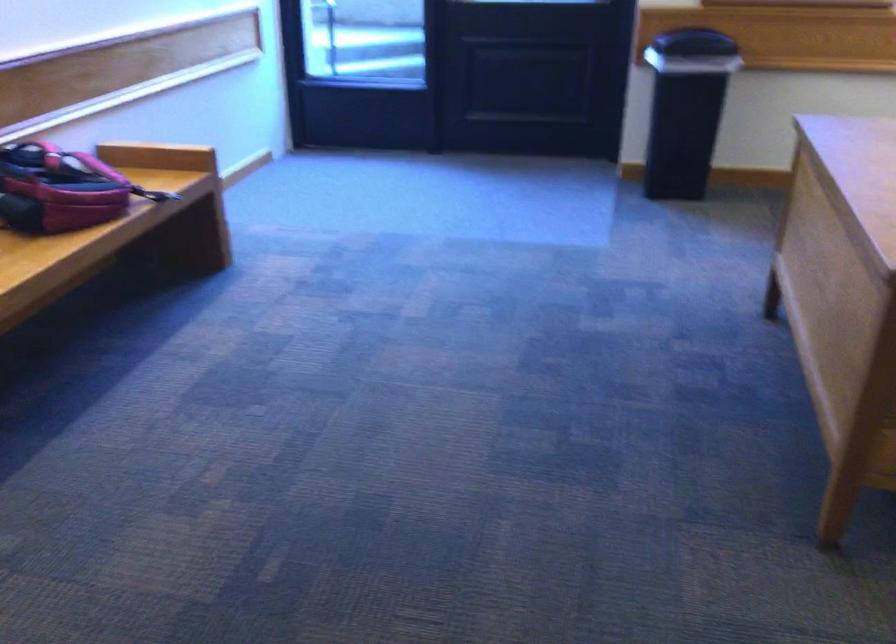
Where is `trash can lid`? This screenshot has width=896, height=644. trash can lid is located at coordinates (694, 43).